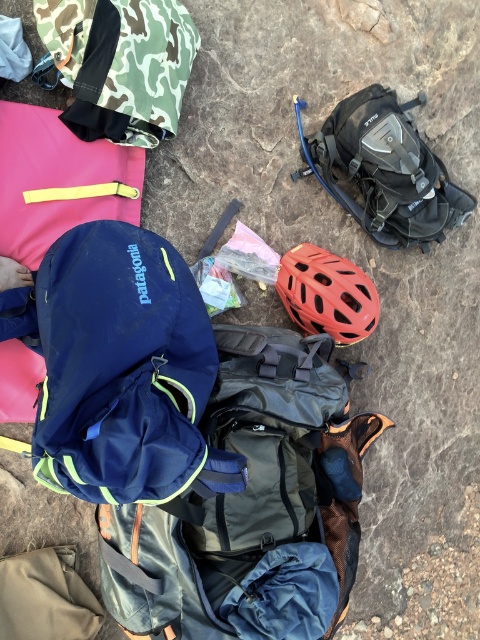
You are packing for a day hike and have both the camo fabric backpack at upper left and the black matte hydration backpack at upper right. Which backpack should you choose if you want to carry more gear?

The black matte hydration backpack at upper right has a larger size than the camo fabric backpack at upper left, so it can carry more gear.

You are a hiker planning to place a 18 inch long hiking pole between the camo fabric backpack at upper left and the black matte hydration backpack at upper right. Can the pole fit between them without touching either backpack?

The distance between the camo fabric backpack at upper left and the black matte hydration backpack at upper right is 17.82 inches. Since the pole is 18 inches long, it is slightly longer than the space available. Therefore, the pole cannot fit between them without touching either backpack.

You are a hiker preparing to pack your gear. You have a camo fabric backpack at upper left and a matte red helmet at center. Which item is placed higher up in the scene?

The camo fabric backpack at upper left is positioned over the matte red helmet at center, so it is higher up in the scene.